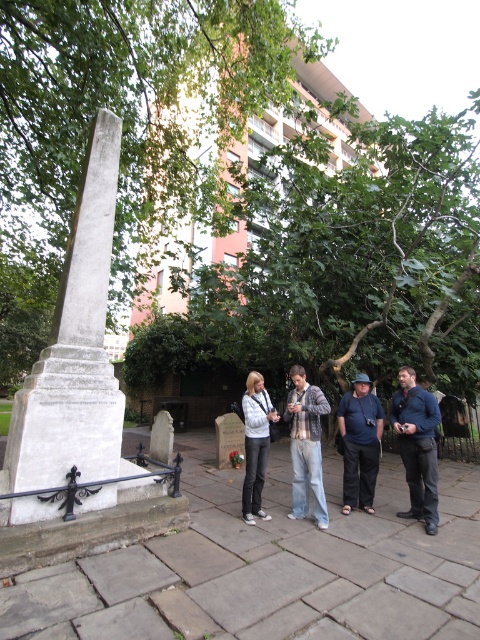
Question: Is blue denim jacket at lower right behind white matte jacket at center?

Choices:
 (A) yes
 (B) no

Answer: (B)

Question: Which point is closer to the camera?

Choices:
 (A) blue denim jacket at lower right
 (B) white stone obelisk at left
 (C) plaid shirt at center
 (D) blue cotton shirt at center

Answer: (B)

Question: Which point is closer to the camera?

Choices:
 (A) (146, 499)
 (B) (362, 461)

Answer: (A)

Question: Can you confirm if white stone obelisk at left is positioned to the left of blue cotton shirt at center?

Choices:
 (A) yes
 (B) no

Answer: (A)

Question: Observing the image, what is the correct spatial positioning of blue denim jacket at lower right in reference to plaid shirt at center?

Choices:
 (A) right
 (B) left

Answer: (A)

Question: Estimate the real-world distances between objects in this image. Which object is farther from the white matte jacket at center?

Choices:
 (A) blue denim jacket at lower right
 (B) plaid shirt at center
 (C) blue cotton shirt at center

Answer: (A)